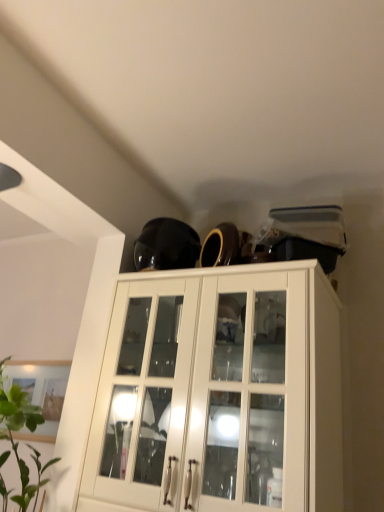
Question: In the image, is white glossy cabinet at upper center positioned in front of or behind green leafy plant at lower left?

Choices:
 (A) front
 (B) behind

Answer: (B)

Question: Based on their positions, is white glossy cabinet at upper center located to the left or right of green leafy plant at lower left?

Choices:
 (A) right
 (B) left

Answer: (A)

Question: From a real-world perspective, is white glossy cabinet at upper center above or below green leafy plant at lower left?

Choices:
 (A) above
 (B) below

Answer: (A)

Question: Considering their positions, is green leafy plant at lower left located in front of or behind white glossy cabinet at upper center?

Choices:
 (A) front
 (B) behind

Answer: (A)

Question: Considering the positions of green leafy plant at lower left and white glossy cabinet at upper center in the image, is green leafy plant at lower left wider or thinner than white glossy cabinet at upper center?

Choices:
 (A) wide
 (B) thin

Answer: (B)

Question: Is green leafy plant at lower left situated inside white glossy cabinet at upper center or outside?

Choices:
 (A) inside
 (B) outside

Answer: (B)

Question: In terms of height, does green leafy plant at lower left look taller or shorter compared to white glossy cabinet at upper center?

Choices:
 (A) short
 (B) tall

Answer: (A)